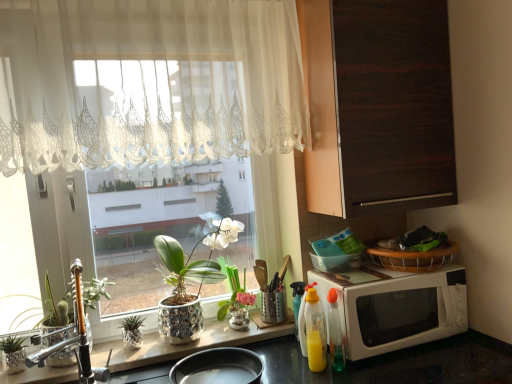
The height and width of the screenshot is (384, 512). I want to click on free space to the left of matte silver pot at center, the 1th houseplant when ordered from right to left, so click(207, 335).